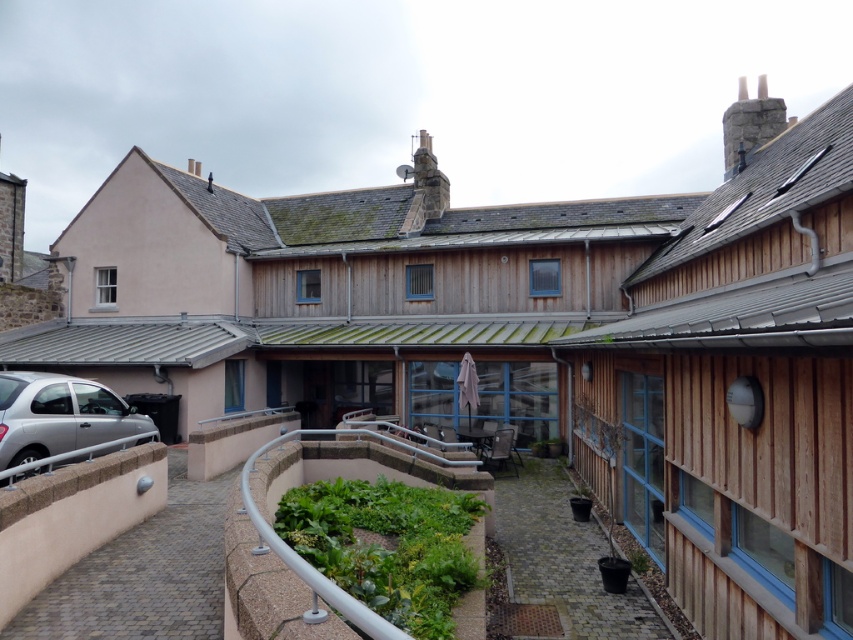
Looking at this image, does green leafy plants at center have a greater height compared to silver metallic car at lower left?

Incorrect, green leafy plants at center's height is not larger of silver metallic car at lower left's.

Which of these two, green leafy plants at center or silver metallic car at lower left, stands shorter?

green leafy plants at center is shorter.

This screenshot has height=640, width=853. Find the location of `green leafy plants at center`. green leafy plants at center is located at coordinates (387, 548).

You are a GUI agent. You are given a task and a screenshot of the screen. Output one action in this format:
    pyautogui.click(x=<x>, y=<y>)
    Task: Click on the green leafy plants at center
    This screenshot has height=640, width=853.
    Given the screenshot: What is the action you would take?
    pyautogui.click(x=387, y=548)